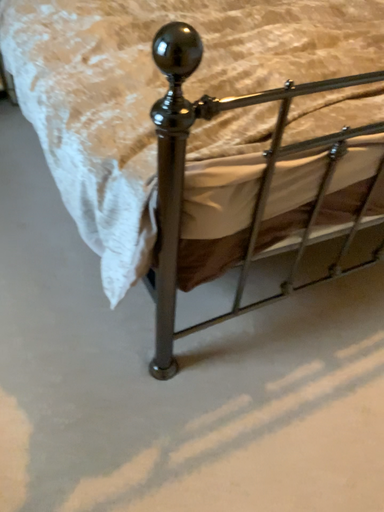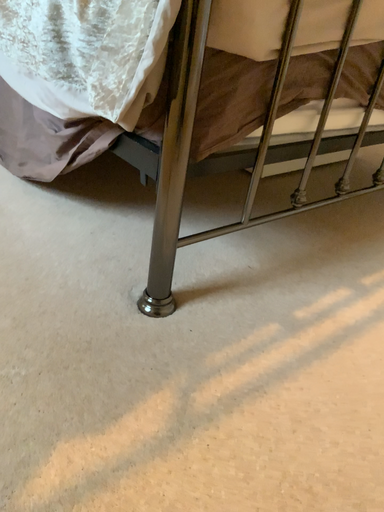
Question: How did the camera likely rotate when shooting the video?

Choices:
 (A) rotated right
 (B) rotated left

Answer: (A)